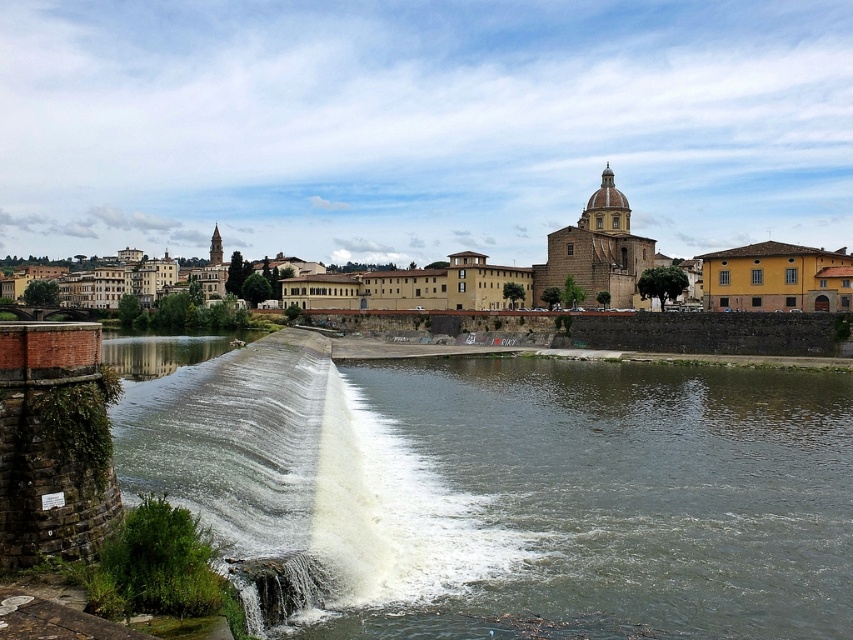
Can you confirm if white frothy water at center is positioned to the left of brown stone buildings at upper center?

In fact, white frothy water at center is to the right of brown stone buildings at upper center.

The image size is (853, 640). Find the location of `white frothy water at center`. white frothy water at center is located at coordinates (306, 481).